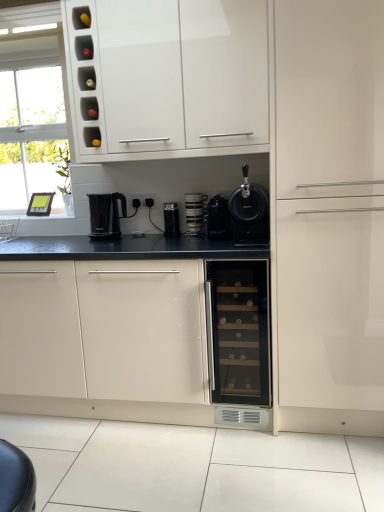
Where is `unoccupied area in front of black plastic toaster at center, placed as the third kitchen appliance when sorted from right to left`? unoccupied area in front of black plastic toaster at center, placed as the third kitchen appliance when sorted from right to left is located at coordinates (182, 236).